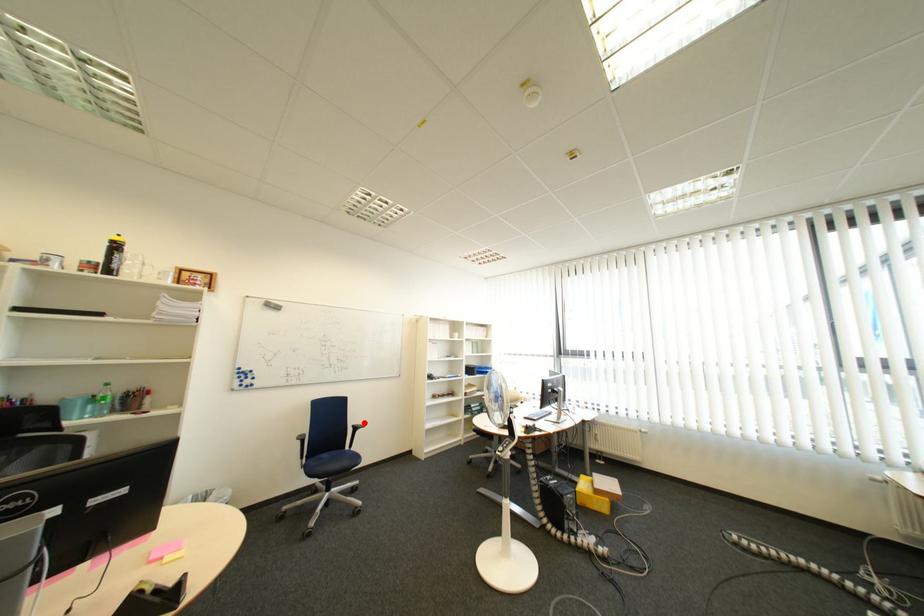
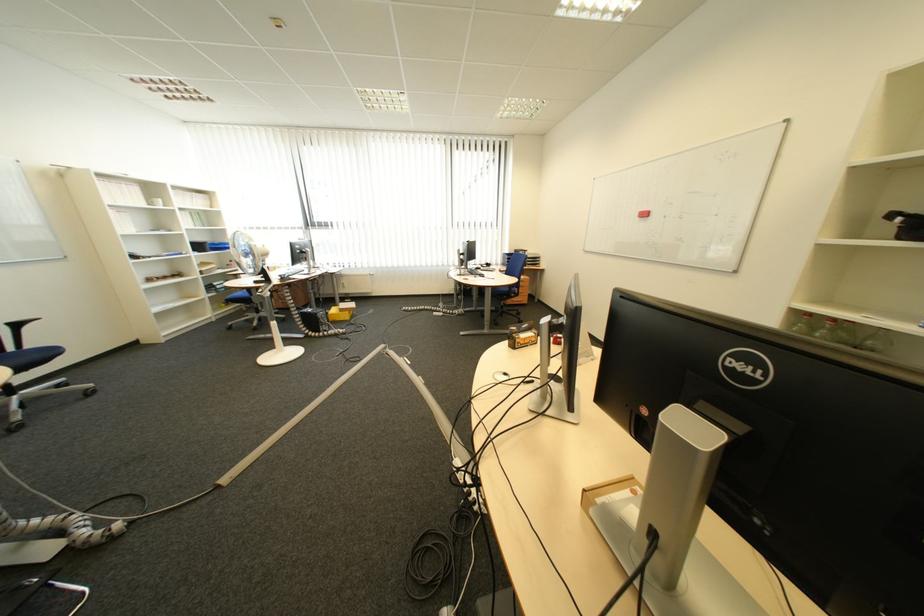
Question: I am providing you with two images of the same scene from different viewpoints. A red point is shown in image1. For the corresponding object point in image2, is it positioned nearer or farther from the camera?

Choices:
 (A) Nearer
 (B) Farther

Answer: (B)